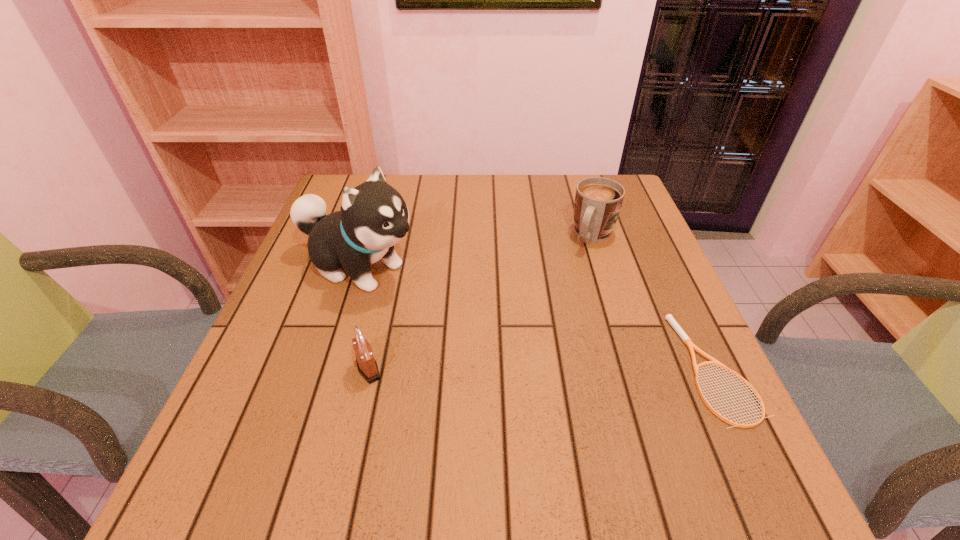
Identify the location of vacant space on the desktop that is between the padlock and the tennis racket and is positioned at the face of the tallest object. (589, 368).

Identify the location of free space on the desktop that is between the padlock and the rightmost object and is positioned on the side of the mug with the handle. The image size is (960, 540). (521, 369).